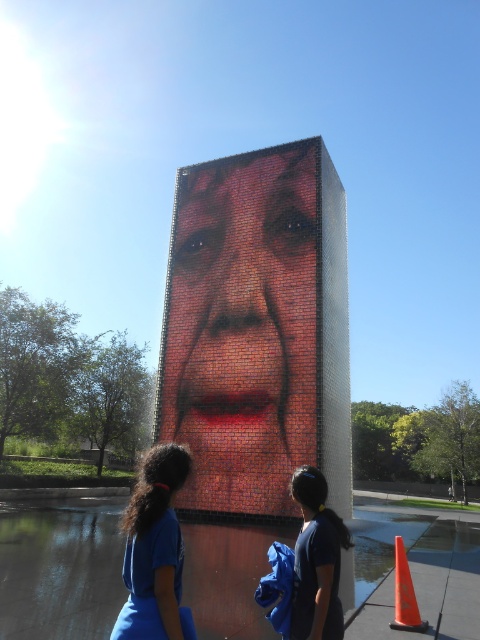
Question: Estimate the real-world distances between objects in this image. Which object is closer to the brick mosaic face at center?

Choices:
 (A) glossy concrete pavement at lower center
 (B) blue fabric ponytail at lower left

Answer: (A)

Question: Observing the image, what is the correct spatial positioning of glossy concrete pavement at lower center in reference to orange plastic cone at lower right?

Choices:
 (A) right
 (B) left

Answer: (A)

Question: Which object appears closest to the camera in this image?

Choices:
 (A) glossy concrete pavement at lower center
 (B) brick mosaic face at center
 (C) blue fabric ponytail at lower left
 (D) blue fabric at lower center

Answer: (C)

Question: Is blue fabric at lower center below orange plastic cone at lower right?

Choices:
 (A) no
 (B) yes

Answer: (A)

Question: Which point appears closest to the camera in this image?

Choices:
 (A) (336, 557)
 (B) (398, 612)
 (C) (148, 518)

Answer: (C)

Question: Is glossy concrete pavement at lower center further to the viewer compared to blue fabric ponytail at lower left?

Choices:
 (A) yes
 (B) no

Answer: (A)